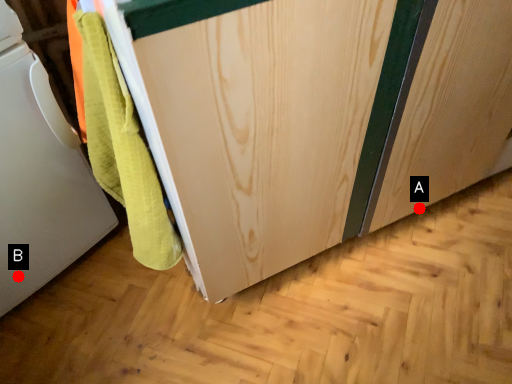
Question: Two points are circled on the image, labeled by A and B beside each circle. Which point is farther from the camera taking this photo?

Choices:
 (A) A is further
 (B) B is further

Answer: (A)